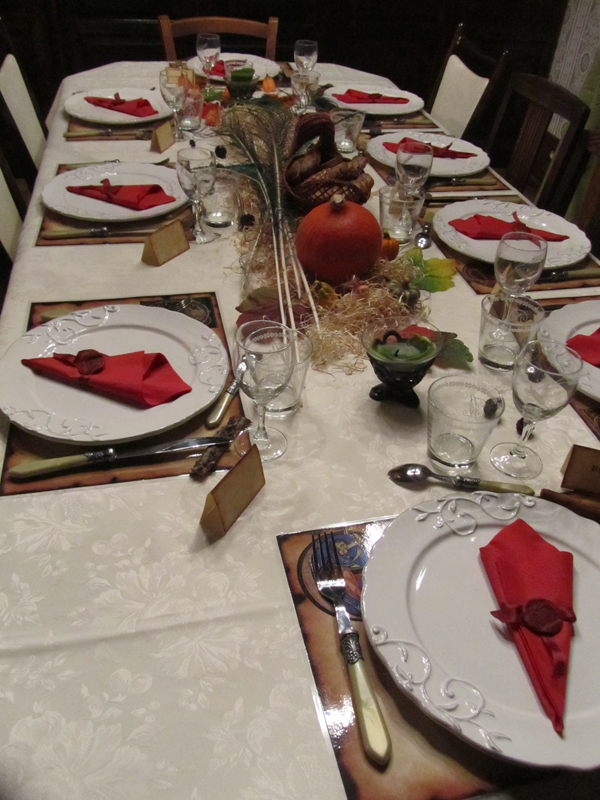
This screenshot has height=800, width=600. I want to click on water glasses, so click(x=444, y=434), click(x=497, y=342), click(x=294, y=390), click(x=396, y=217), click(x=349, y=130), click(x=312, y=94), click(x=232, y=69), click(x=194, y=110), click(x=219, y=214).